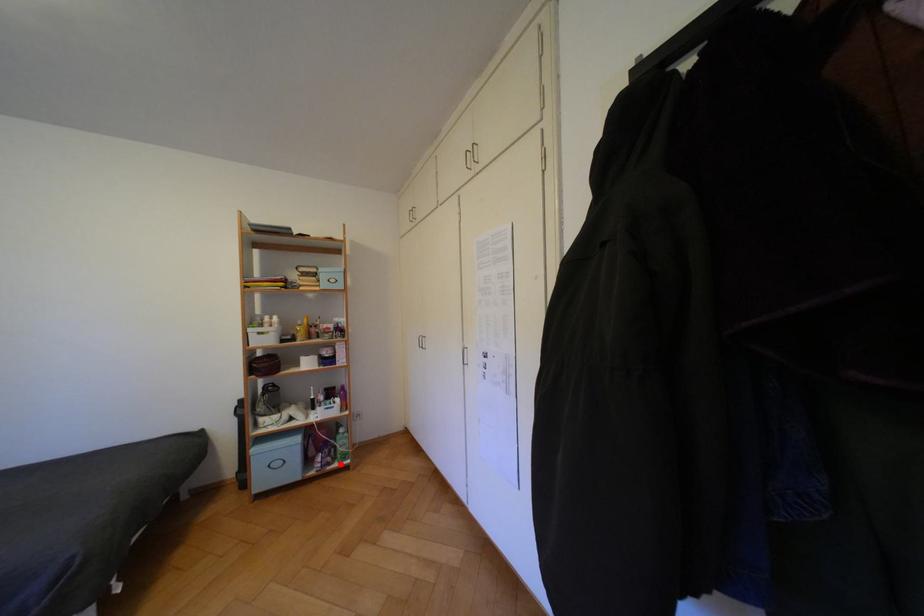
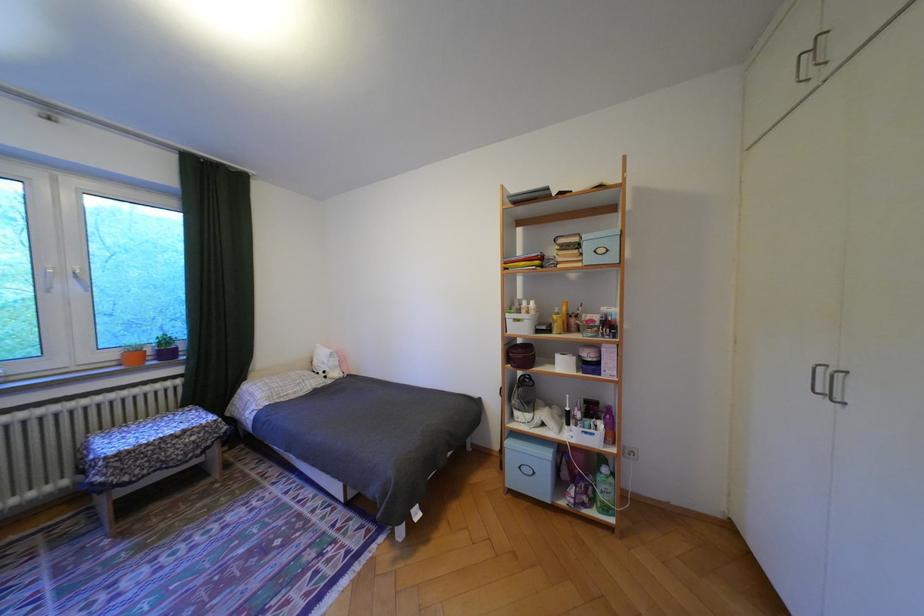
In the second image, find the point that corresponds to the highlighted location in the first image.

(596, 505)